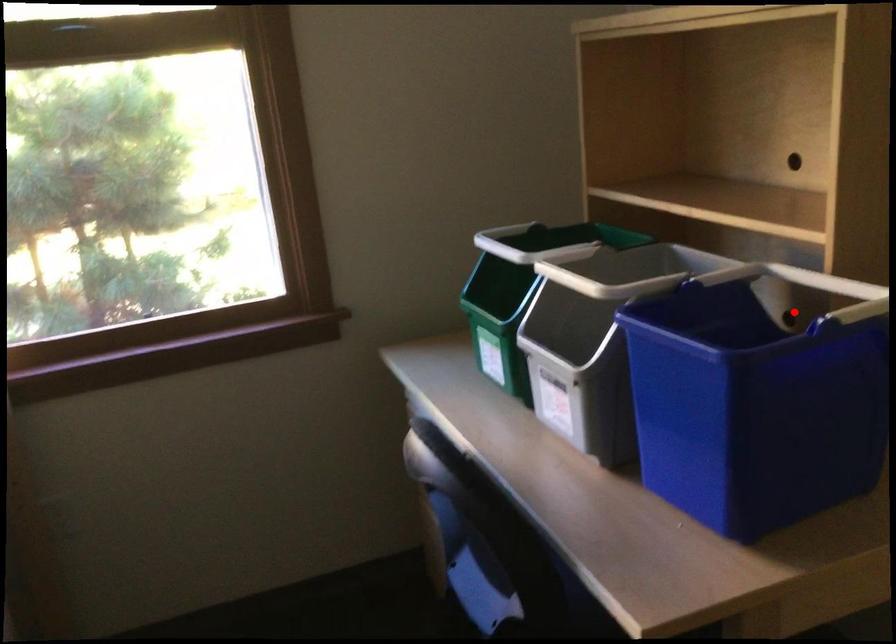
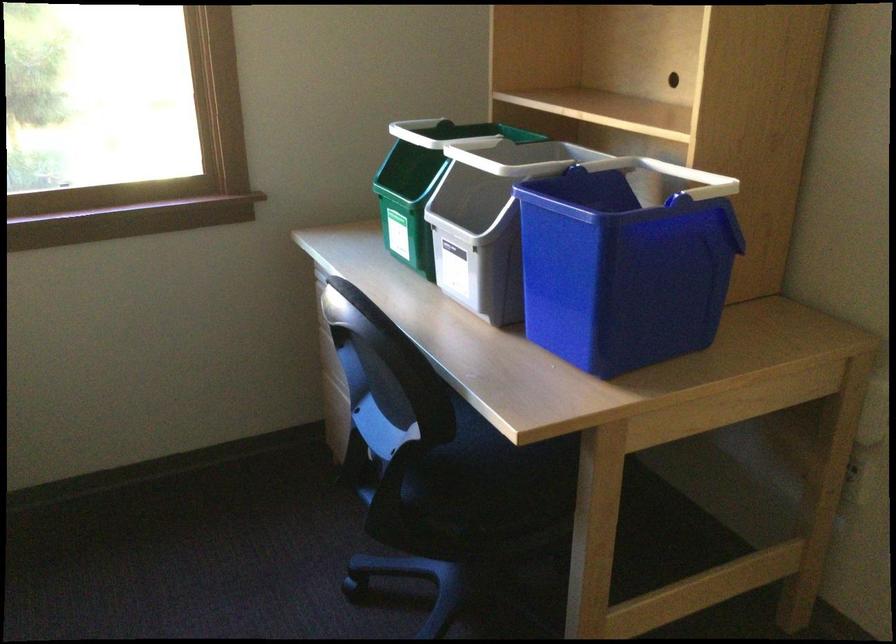
Question: I am providing you with two images of the same scene from different viewpoints. A red point is marked on the first image. Is the red point's position out of view in image 2?

Choices:
 (A) Yes
 (B) No

Answer: (A)